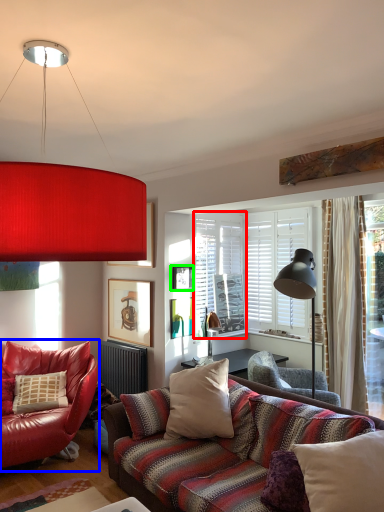
Question: Based on their relative distances, which object is farther from window screen (highlighted by a red box)? Choose from chair (highlighted by a blue box) and picture frame (highlighted by a green box).

Choices:
 (A) chair
 (B) picture frame

Answer: (A)